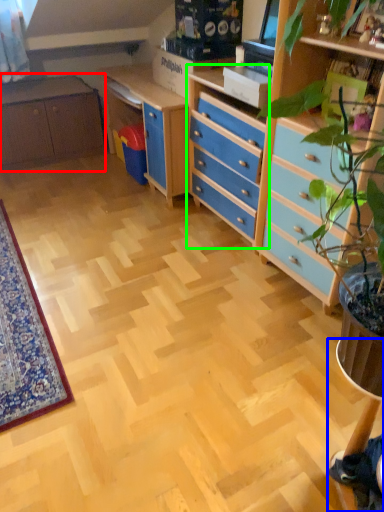
Question: Which object is the closest to the cabinetry (highlighted by a red box)? Choose among these: computer desk (highlighted by a blue box) or chest of drawers (highlighted by a green box).

Choices:
 (A) computer desk
 (B) chest of drawers

Answer: (B)